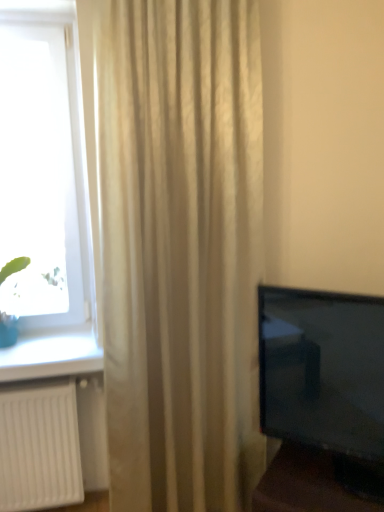
Question: Is transparent glass window at left at the back of green leafy plant at left?

Choices:
 (A) yes
 (B) no

Answer: (A)

Question: Considering the relative sizes of green leafy plant at left and transparent glass window at left in the image provided, is green leafy plant at left taller than transparent glass window at left?

Choices:
 (A) no
 (B) yes

Answer: (A)

Question: Is green leafy plant at left oriented towards transparent glass window at left?

Choices:
 (A) yes
 (B) no

Answer: (B)

Question: From a real-world perspective, is green leafy plant at left beneath transparent glass window at left?

Choices:
 (A) no
 (B) yes

Answer: (B)

Question: From a real-world perspective, does green leafy plant at left stand above transparent glass window at left?

Choices:
 (A) yes
 (B) no

Answer: (B)

Question: Can you confirm if green leafy plant at left is shorter than transparent glass window at left?

Choices:
 (A) yes
 (B) no

Answer: (A)

Question: Is beige textured curtain at center closer to the viewer compared to transparent glass window at left?

Choices:
 (A) no
 (B) yes

Answer: (B)

Question: Is beige textured curtain at center positioned with its back to transparent glass window at left?

Choices:
 (A) no
 (B) yes

Answer: (A)

Question: Does beige textured curtain at center appear on the left side of transparent glass window at left?

Choices:
 (A) yes
 (B) no

Answer: (B)

Question: Can you confirm if beige textured curtain at center is shorter than transparent glass window at left?

Choices:
 (A) yes
 (B) no

Answer: (B)

Question: Is beige textured curtain at center wider than transparent glass window at left?

Choices:
 (A) no
 (B) yes

Answer: (B)

Question: Would you say transparent glass window at left is part of beige textured curtain at center's contents?

Choices:
 (A) no
 (B) yes

Answer: (A)

Question: Are green leafy plant at left and beige textured curtain at center located far from each other?

Choices:
 (A) no
 (B) yes

Answer: (A)